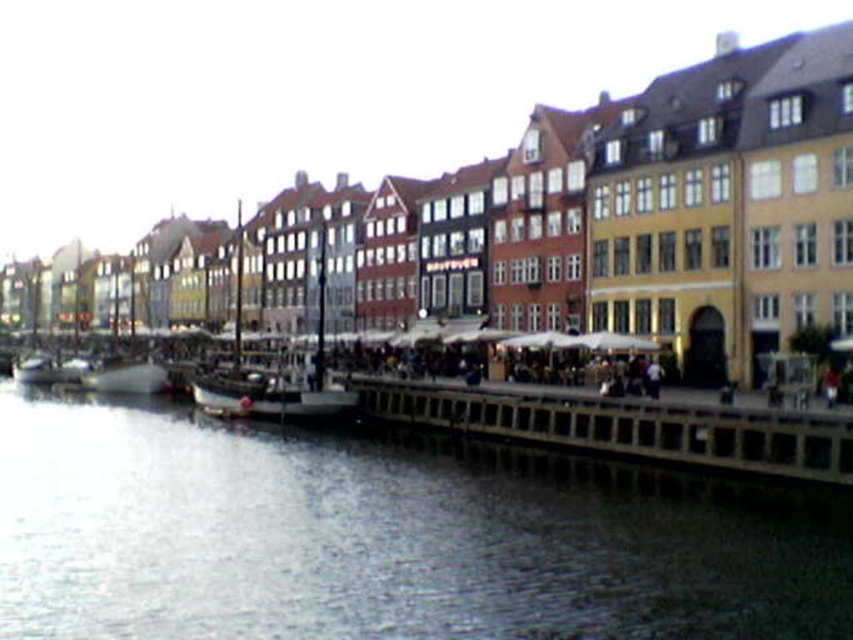
You are a tourist standing at the waterfront and want to take a photo of the wooden dock at lower center and the white matte boat at lower left. Which object appears taller in the photo?

The wooden dock at lower center is taller than the white matte boat at lower left according to the description.

You are standing on a dock and see the clear water at lower left and the white matte boat at lower left. Which object is positioned to the right of the other?

The clear water at lower left is to the right of the white matte boat at lower left.

You are a tourist standing at the waterfront and see the clear water at lower left and the white matte boat at lower left. Which object is closer to the water surface?

The clear water at lower left is located below the white matte boat at lower left, so the clear water at lower left is closer to the water surface.